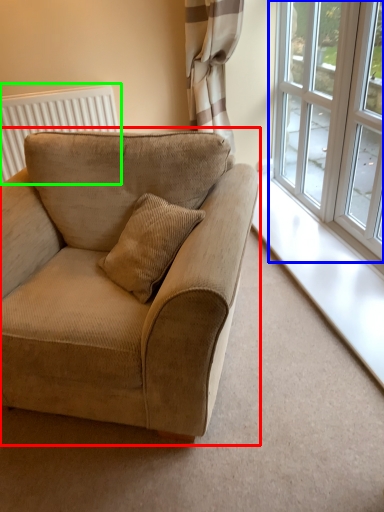
Question: Which object is the farthest from studio couch (highlighted by a red box)? Choose among these: window (highlighted by a blue box) or radiator (highlighted by a green box).

Choices:
 (A) window
 (B) radiator

Answer: (B)